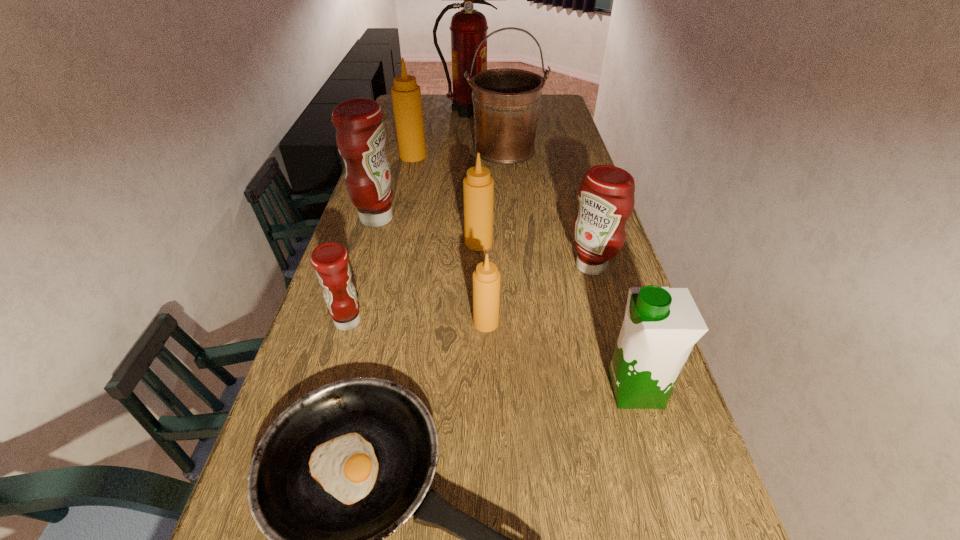
Locate an element on the screen. This screenshot has width=960, height=540. the nearest tan condiment is located at coordinates (486, 278).

Identify the location of the smallest red condiment. (330, 260).

The width and height of the screenshot is (960, 540). I want to click on free location located 0.070m on the front-facing side of the red fire extinguisher, so 512,111.

Identify the location of free location located 0.250m on the left of the bucket. This screenshot has width=960, height=540. (406, 150).

Find the location of a particular element. The image size is (960, 540). free space located 0.060m on the left of the leftmost tan condiment is located at coordinates (385, 156).

The image size is (960, 540). What are the coordinates of `free space located on the back of the farthest red condiment` in the screenshot? It's located at (394, 163).

Image resolution: width=960 pixels, height=540 pixels. Find the location of `vacant region located on the front of the second nearest tan condiment`. vacant region located on the front of the second nearest tan condiment is located at coordinates (478, 350).

Where is `vacant space located on the left of the rightmost condiment`? This screenshot has width=960, height=540. vacant space located on the left of the rightmost condiment is located at coordinates (517, 266).

You are a GUI agent. You are given a task and a screenshot of the screen. Output one action in this format:
    pyautogui.click(x=<x>, y=<y>)
    Task: Click on the vacant area situated 0.110m on the front-facing side of the green soya milk
    Image resolution: width=960 pixels, height=540 pixels.
    Given the screenshot: What is the action you would take?
    coord(557,389)

This screenshot has height=540, width=960. Find the location of `free spot located on the front-facing side of the green soya milk`. free spot located on the front-facing side of the green soya milk is located at coordinates (520, 389).